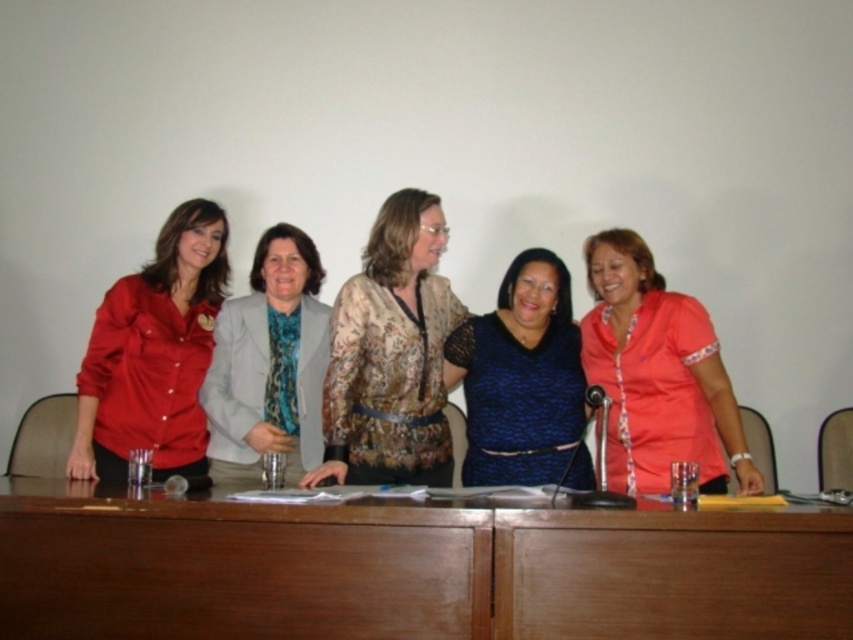
You are a server in a restaurant that has a brown wooden table at center and a matte gray blazer at center. The distance between them is 1.06 meters. You need to bring a tray of drinks to the table without bumping into the blazer. Can you safely navigate the space between them?

The distance between the brown wooden table at center and the matte gray blazer at center is 1.06 meters. Since the server needs to navigate with a tray, this distance should be sufficient as long as they move carefully, ensuring they don

You are a photographer setting up for a group photo. You need to adjust the height of the microphone stand so that it reaches the mouth level of both the matte red blouse at left and the matte gray blazer at center. Since their heights differ, which person should you adjust the stand for first?

The matte red blouse at left has a greater height compared to the matte gray blazer at center, so you should first adjust the microphone stand to reach the mouth level of the matte red blouse at left, then lower it slightly for the matte gray blazer at center.